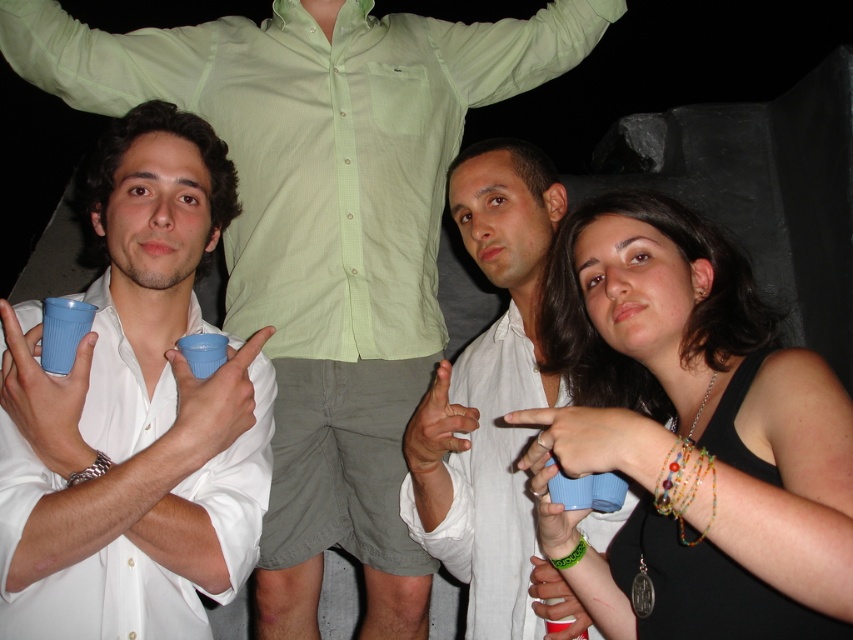
Who is higher up, matte blue cup at center or white matte shirt at center?

white matte shirt at center is higher up.

Which is more to the left, matte blue cup at center or white matte shirt at center?

white matte shirt at center

Locate an element on the screen. Image resolution: width=853 pixels, height=640 pixels. matte blue cup at center is located at coordinates (689, 433).

Is matte white shirt at center wider than white matte shirt at center?

Yes.

Is matte white shirt at center shorter than white matte shirt at center?

Incorrect, matte white shirt at center's height does not fall short of white matte shirt at center's.

Where is `matte white shirt at center`? The width and height of the screenshot is (853, 640). matte white shirt at center is located at coordinates (323, 220).

Is matte white shirt at center to the right of matte plastic cup at left from the viewer's perspective?

Indeed, matte white shirt at center is positioned on the right side of matte plastic cup at left.

Can you confirm if matte white shirt at center is bigger than matte plastic cup at left?

Yes.

Between point (366, 417) and point (134, 540), which one is positioned behind?

Point (366, 417)

Where is `matte white shirt at center`? This screenshot has height=640, width=853. matte white shirt at center is located at coordinates (323, 220).